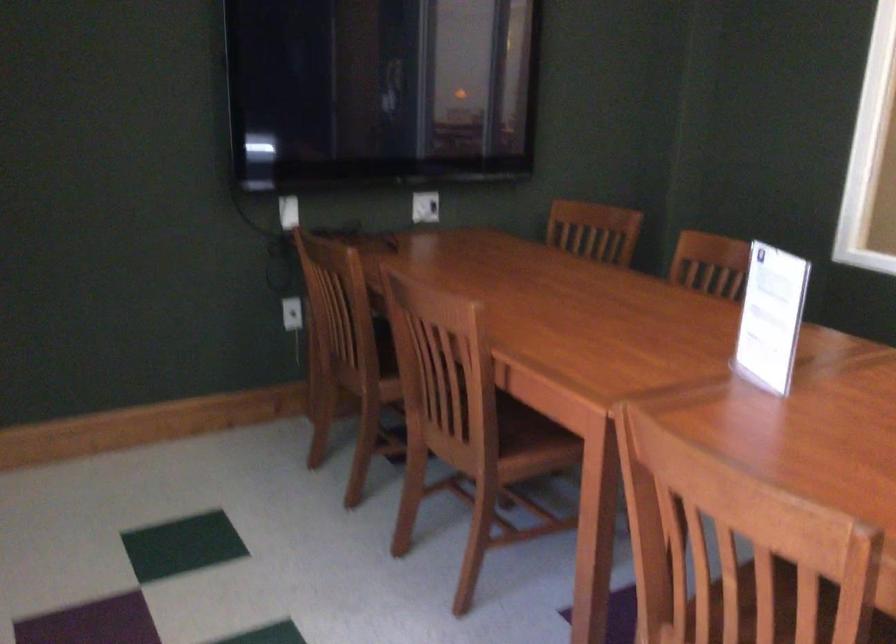
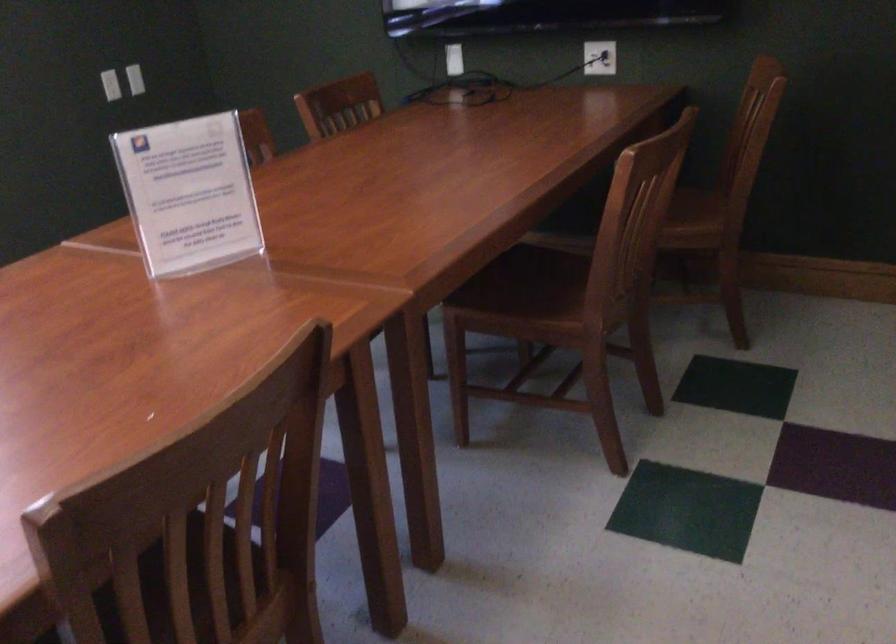
Find the pixel in the second image that matches (442,202) in the first image.

(599, 58)